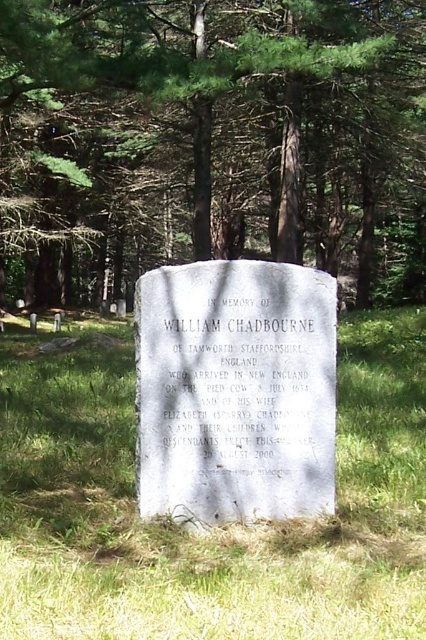
Question: Which point is farther from the camera taking this photo?

Choices:
 (A) (353, 532)
 (B) (250, 170)

Answer: (B)

Question: Considering the relative positions of green leafy tree at center and green grass at center in the image provided, where is green leafy tree at center located with respect to green grass at center?

Choices:
 (A) below
 (B) above

Answer: (B)

Question: Which object is farther from the camera taking this photo?

Choices:
 (A) green grass at center
 (B) green leafy tree at center

Answer: (B)

Question: Among these objects, which one is nearest to the camera?

Choices:
 (A) green leafy tree at center
 (B) green grass at center

Answer: (B)

Question: Is green leafy tree at center closer to camera compared to green grass at center?

Choices:
 (A) yes
 (B) no

Answer: (B)

Question: Does green leafy tree at center appear over green grass at center?

Choices:
 (A) no
 (B) yes

Answer: (B)